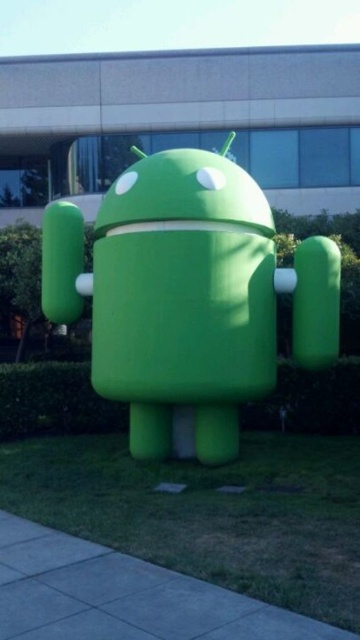
You are a delivery drone flying at 10 meters above the ground. You need to land on the gray concrete pavement at lower left. Can you safely descend vertically without hitting the green matte robot at center?

The green matte robot at center is taller than the gray concrete pavement at lower left. Since the drone is flying at 10 meters, which is much higher than the robot, it can safely descend vertically to land on the gray concrete pavement at lower left without any collision.

You are standing on the gray concrete pavement at lower left and want to climb onto the green matte robot at center. Is the robot above or below your current position?

The green matte robot at center is above the gray concrete pavement at lower left, so it is higher than your current position.

You are standing at the entrance of the modern building and want to take a photo of the green matte robot at center. Based on its position, where should you position yourself to ensure it is centered in your camera frame?

Since the green matte robot at center is located at point coordinates approximately 0.464 on the x and 0.519 on the y axis, you should position yourself directly in front of it along its central axis to ensure it is centered in your camera frame.